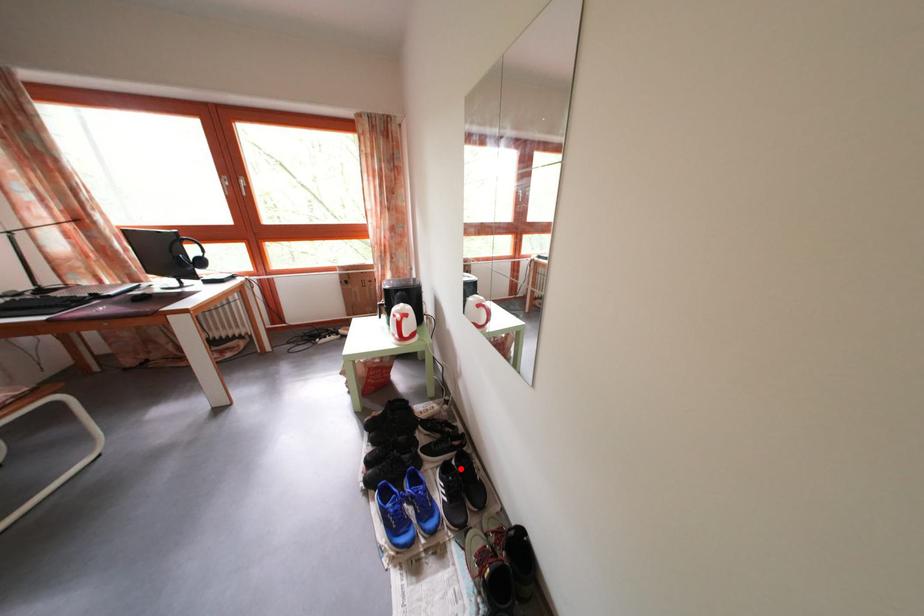
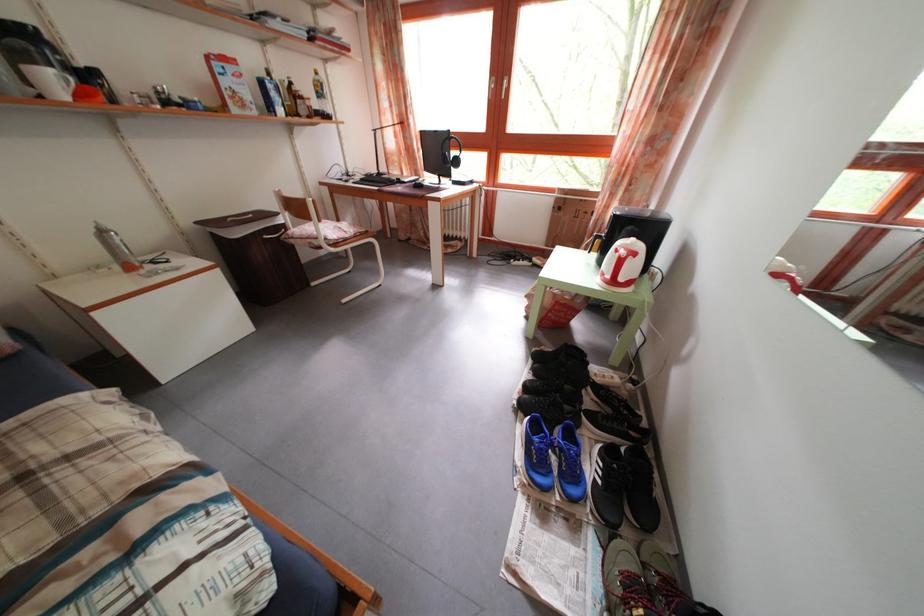
Where in the second image is the point corresponding to the highlighted location from the first image?

(629, 458)